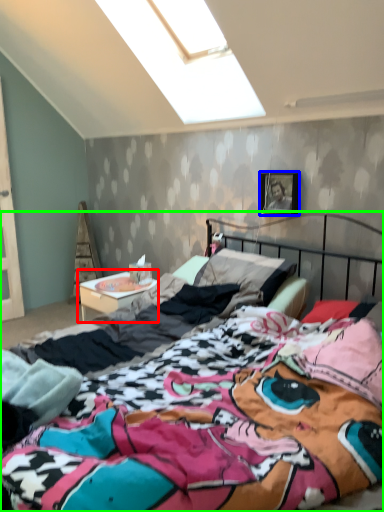
Question: Which object is positioned closest to nightstand (highlighted by a red box)? Select from picture frame (highlighted by a blue box) and bed (highlighted by a green box).

Choices:
 (A) picture frame
 (B) bed

Answer: (A)